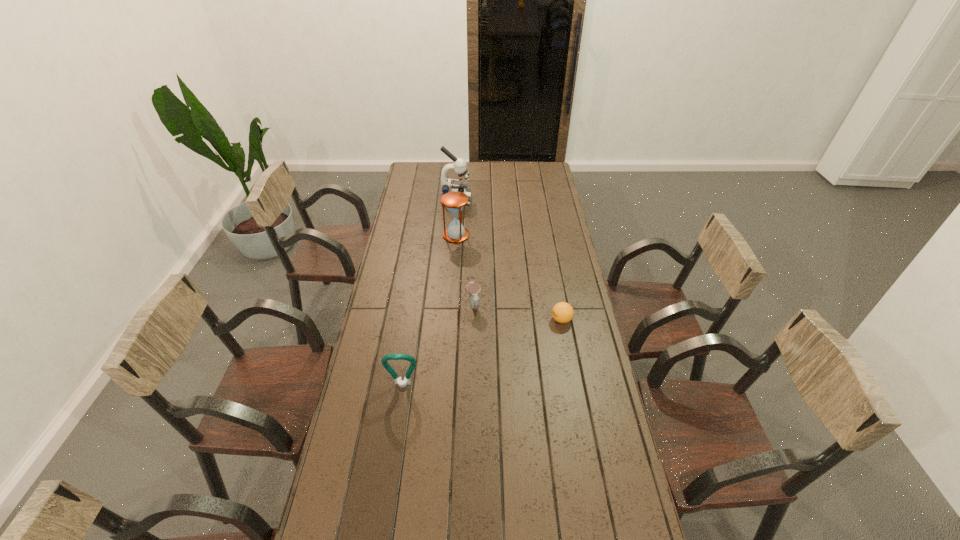
Find the location of a particular element. vacant area that lies between the ping-pong ball and the second farthest object is located at coordinates (509, 278).

I want to click on object that ranks as the third closest to the second shortest object, so click(454, 201).

The width and height of the screenshot is (960, 540). I want to click on object identified as the third closest to the fourth tallest object, so click(454, 201).

This screenshot has height=540, width=960. What are the coordinates of `vacant region that satisfies the following two spatial constraints: 1. at the eyepiece of the second farthest object; 2. on the left side of the tallest object` in the screenshot? It's located at (453, 235).

This screenshot has width=960, height=540. Identify the location of vacant space that satisfies the following two spatial constraints: 1. at the eyepiece of the farthest object; 2. at the jaws of the third tallest object. (442, 385).

I want to click on blank space that satisfies the following two spatial constraints: 1. at the eyepiece of the farthest object; 2. on the back side of the hourglass, so click(453, 235).

You are a GUI agent. You are given a task and a screenshot of the screen. Output one action in this format:
    pyautogui.click(x=<x>, y=<y>)
    Task: Click on the free space that satisfies the following two spatial constraints: 1. at the eyepiece of the hourglass; 2. on the right side of the microscope
    
    Given the screenshot: What is the action you would take?
    pyautogui.click(x=453, y=235)

The width and height of the screenshot is (960, 540). Identify the location of vacant space that satisfies the following two spatial constraints: 1. at the eyepiece of the second farthest object; 2. on the right side of the tallest object. (453, 235).

Where is `free spot that satisfies the following two spatial constraints: 1. on the back side of the watch; 2. at the eyepiece of the farthest object`? This screenshot has height=540, width=960. free spot that satisfies the following two spatial constraints: 1. on the back side of the watch; 2. at the eyepiece of the farthest object is located at coordinates (475, 199).

Image resolution: width=960 pixels, height=540 pixels. What are the coordinates of `vacant space that satisfies the following two spatial constraints: 1. at the eyepiece of the tallest object; 2. at the jaws of the third shortest object` in the screenshot? It's located at (442, 385).